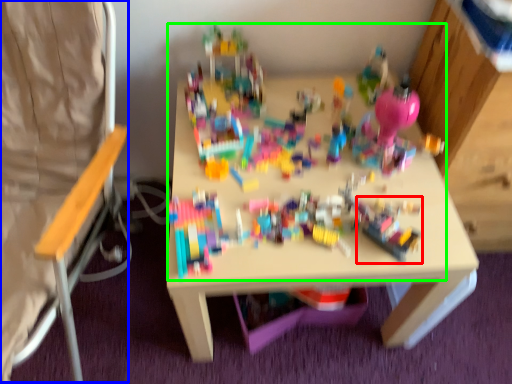
Question: Considering the real-world distances, which object is farthest from toy (highlighted by a red box)? folding chair (highlighted by a blue box) or toy (highlighted by a green box)?

Choices:
 (A) folding chair
 (B) toy

Answer: (A)